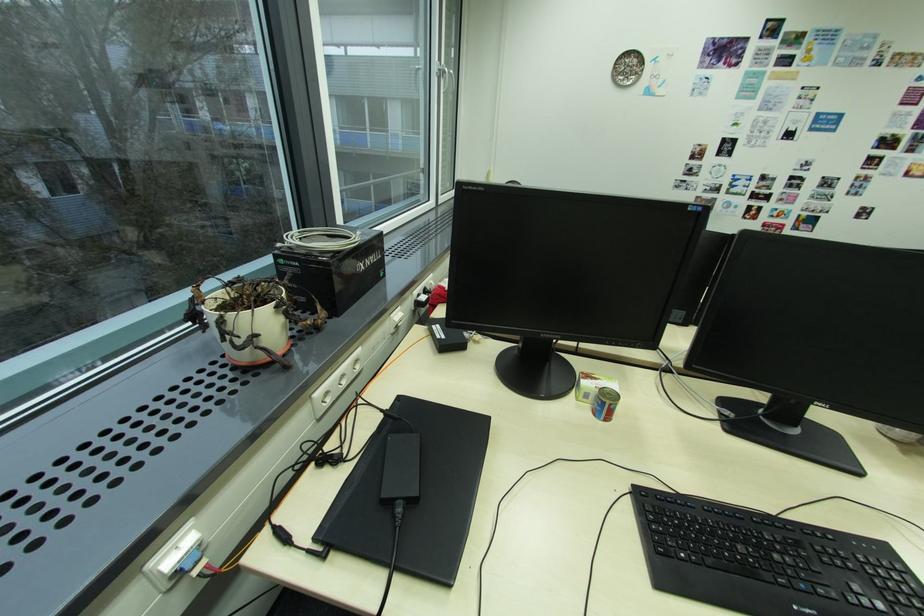
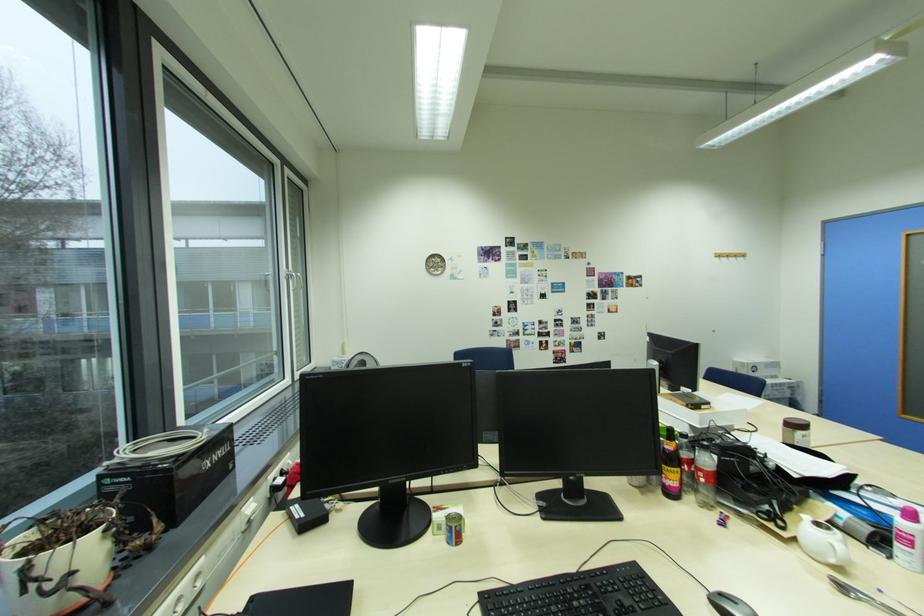
Find the pixel in the second image that matches point 593,385 in the first image.

(444, 517)